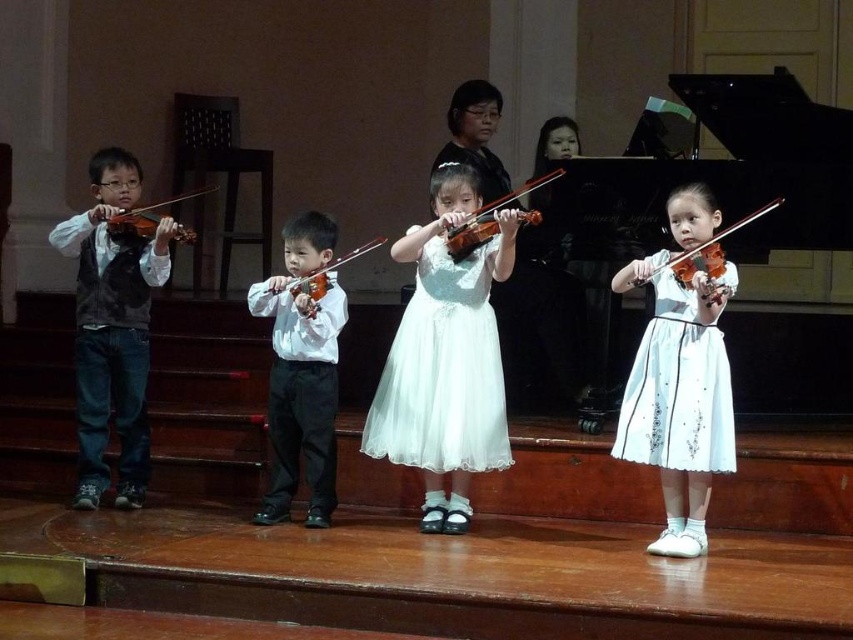
Can you confirm if white smooth shirt at center is wider than matte black violin at left?

Correct, the width of white smooth shirt at center exceeds that of matte black violin at left.

Between white smooth shirt at center and matte black violin at left, which one has less height?

matte black violin at left is shorter.

Is point (325, 504) farther from camera compared to point (128, 209)?

No, it is in front of (128, 209).

You are a GUI agent. You are given a task and a screenshot of the screen. Output one action in this format:
    pyautogui.click(x=<x>, y=<y>)
    Task: Click on the white smooth shirt at center
    Image resolution: width=853 pixels, height=640 pixels.
    Given the screenshot: What is the action you would take?
    pyautogui.click(x=300, y=372)

Is white glossy violin at center wider than matte brown violin at center?

Yes, white glossy violin at center is wider than matte brown violin at center.

Does white glossy violin at center lie behind matte brown violin at center?

That is False.

Measure the distance between white glossy violin at center and camera.

They are 4.04 meters apart.

The height and width of the screenshot is (640, 853). I want to click on white glossy violin at center, so click(x=488, y=220).

Between matte black vest at left and white glossy violin at center, which one appears on the left side from the viewer's perspective?

From the viewer's perspective, matte black vest at left appears more on the left side.

Is matte black vest at left bigger than white glossy violin at center?

Correct, matte black vest at left is larger in size than white glossy violin at center.

The image size is (853, 640). Identify the location of matte black vest at left. (112, 326).